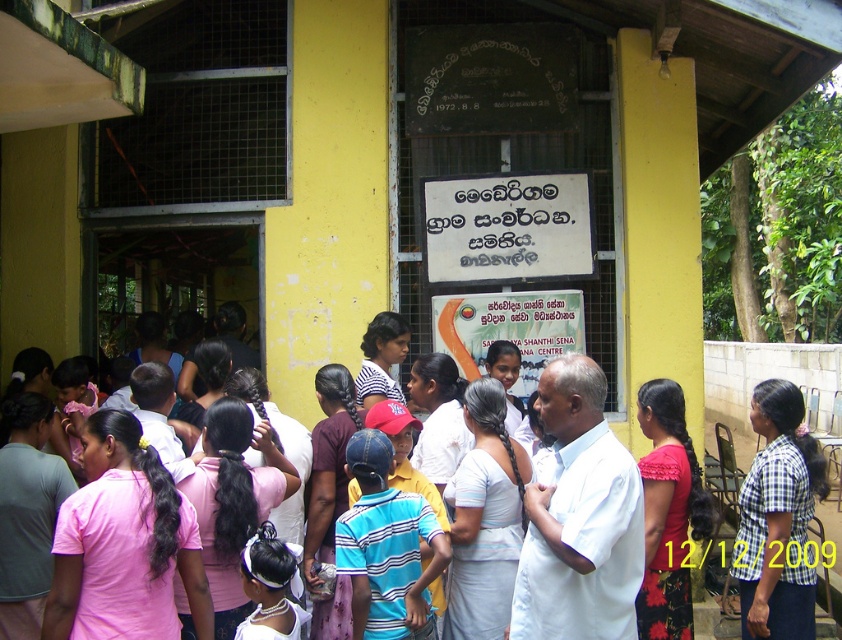
Is pink cotton shirt at center to the left of white paper sign at center from the viewer's perspective?

No, pink cotton shirt at center is not to the left of white paper sign at center.

Does pink cotton shirt at center have a greater height compared to white paper sign at center?

Correct, pink cotton shirt at center is much taller as white paper sign at center.

Does point (722, 349) come behind point (499, 195)?

That is True.

At what (x,y) coordinates should I click in order to perform the action: click on pink cotton shirt at center. Please return your answer as a coordinate pair (x, y). Looking at the image, I should click on (766, 369).